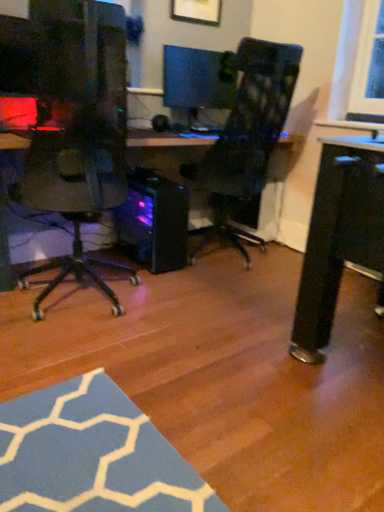
The height and width of the screenshot is (512, 384). Describe the element at coordinates (154, 222) in the screenshot. I see `transparent plastic computer tower at center` at that location.

At what (x,y) coordinates should I click in order to perform the action: click on transparent plastic computer tower at center. Please return your answer as a coordinate pair (x, y). Looking at the image, I should click on (154, 222).

In order to face matte black monitor at center, should I rotate leftwards or rightwards?

You should rotate right by 0.736 degrees.

You are a GUI agent. You are given a task and a screenshot of the screen. Output one action in this format:
    pyautogui.click(x=<x>, y=<y>)
    Task: Click on the matte black monitor at center
    The height and width of the screenshot is (512, 384).
    Given the screenshot: What is the action you would take?
    pyautogui.click(x=199, y=85)

What do you see at coordinates (199, 85) in the screenshot? The height and width of the screenshot is (512, 384). I see `matte black monitor at center` at bounding box center [199, 85].

The image size is (384, 512). What are the coordinates of `transparent plastic computer tower at center` in the screenshot? It's located at (154, 222).

Between transparent plastic computer tower at center and matte black monitor at center, which one appears on the left side from the viewer's perspective?

transparent plastic computer tower at center is more to the left.

Considering their positions, is transparent plastic computer tower at center located in front of or behind matte black monitor at center?

Clearly, transparent plastic computer tower at center is in front of matte black monitor at center.

Which point is more distant from viewer, (x=158, y=199) or (x=225, y=63)?

Positioned behind is point (x=225, y=63).

From the image's perspective, would you say transparent plastic computer tower at center is positioned over matte black monitor at center?

Actually, transparent plastic computer tower at center appears below matte black monitor at center in the image.

From a real-world perspective, is transparent plastic computer tower at center physically located above or below matte black monitor at center?

Clearly, from a real-world perspective, transparent plastic computer tower at center is below matte black monitor at center.

Looking at their sizes, would you say transparent plastic computer tower at center is wider or thinner than matte black monitor at center?

Considering their sizes, transparent plastic computer tower at center looks broader than matte black monitor at center.

From the picture: Who is shorter, transparent plastic computer tower at center or matte black monitor at center?

With less height is matte black monitor at center.

Considering the sizes of transparent plastic computer tower at center and matte black monitor at center in the image, is transparent plastic computer tower at center bigger or smaller than matte black monitor at center?

Clearly, transparent plastic computer tower at center is larger in size than matte black monitor at center.

Is transparent plastic computer tower at center positioned beyond the bounds of matte black monitor at center?

That's correct, transparent plastic computer tower at center is outside of matte black monitor at center.

Are transparent plastic computer tower at center and matte black monitor at center beside each other?

transparent plastic computer tower at center is not next to matte black monitor at center, and they're not touching.

Is matte black monitor at center at the back of transparent plastic computer tower at center?

No, transparent plastic computer tower at center's orientation is not away from matte black monitor at center.

How different are the orientations of transparent plastic computer tower at center and matte black monitor at center in degrees?

The angular difference between transparent plastic computer tower at center and matte black monitor at center is 0.0065 degrees.

The width and height of the screenshot is (384, 512). Find the location of `computer monitor that is on the right side of transparent plastic computer tower at center`. computer monitor that is on the right side of transparent plastic computer tower at center is located at coordinates (199, 85).

Which object is positioned more to the left, matte black monitor at center or transparent plastic computer tower at center?

Positioned to the left is transparent plastic computer tower at center.

In the scene shown: Who is more distant, matte black monitor at center or transparent plastic computer tower at center?

Positioned behind is matte black monitor at center.

Is point (203, 53) less distant than point (138, 209)?

No, it is not.

Based on the photo, from the image's perspective, between matte black monitor at center and transparent plastic computer tower at center, which one is located above?

From the image's view, matte black monitor at center is above.

From a real-world perspective, is matte black monitor at center on transparent plastic computer tower at center?

Yes, from a real-world perspective, matte black monitor at center is on top of transparent plastic computer tower at center.

Is matte black monitor at center wider than transparent plastic computer tower at center?

No.

Considering the relative sizes of matte black monitor at center and transparent plastic computer tower at center in the image provided, is matte black monitor at center shorter than transparent plastic computer tower at center?

Yes, matte black monitor at center is shorter than transparent plastic computer tower at center.

Is matte black monitor at center bigger than transparent plastic computer tower at center?

No, matte black monitor at center is not bigger than transparent plastic computer tower at center.

Choose the correct answer: Is matte black monitor at center inside transparent plastic computer tower at center or outside it?

matte black monitor at center is spatially situated outside transparent plastic computer tower at center.

Is matte black monitor at center far away from transparent plastic computer tower at center?

No.

Is matte black monitor at center oriented towards transparent plastic computer tower at center?

No, matte black monitor at center is not oriented towards transparent plastic computer tower at center.

In the scene shown: What's the angular difference between matte black monitor at center and transparent plastic computer tower at center's facing directions?

The angle between the facing direction of matte black monitor at center and the facing direction of transparent plastic computer tower at center is 0.0065 degrees.

In the image, there is a transparent plastic computer tower at center. Find the location of `computer monitor above it (from the image's perspective)`. computer monitor above it (from the image's perspective) is located at coordinates (199, 85).

Identify the location of computer monitor on the right of transparent plastic computer tower at center. (199, 85).

Where is `computer tower to the left of matte black monitor at center`? This screenshot has width=384, height=512. computer tower to the left of matte black monitor at center is located at coordinates (154, 222).